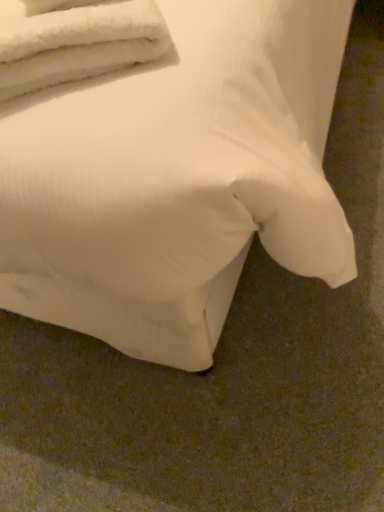
Question: From a real-world perspective, relative to white fluffy towels at upper left, is white fabric bed at center vertically above or below?

Choices:
 (A) above
 (B) below

Answer: (B)

Question: From their relative heights in the image, would you say white fabric bed at center is taller or shorter than white fluffy towels at upper left?

Choices:
 (A) tall
 (B) short

Answer: (A)

Question: Choose the correct answer: Is white fabric bed at center inside white fluffy towels at upper left or outside it?

Choices:
 (A) inside
 (B) outside

Answer: (B)

Question: Does point (115, 11) appear closer or farther from the camera than point (104, 230)?

Choices:
 (A) farther
 (B) closer

Answer: (A)

Question: From a real-world perspective, is white fluffy towels at upper left above or below white fabric bed at center?

Choices:
 (A) below
 (B) above

Answer: (B)

Question: Considering the positions of white fluffy towels at upper left and white fabric bed at center in the image, is white fluffy towels at upper left wider or thinner than white fabric bed at center?

Choices:
 (A) thin
 (B) wide

Answer: (A)

Question: Would you say white fluffy towels at upper left is inside or outside white fabric bed at center?

Choices:
 (A) inside
 (B) outside

Answer: (A)